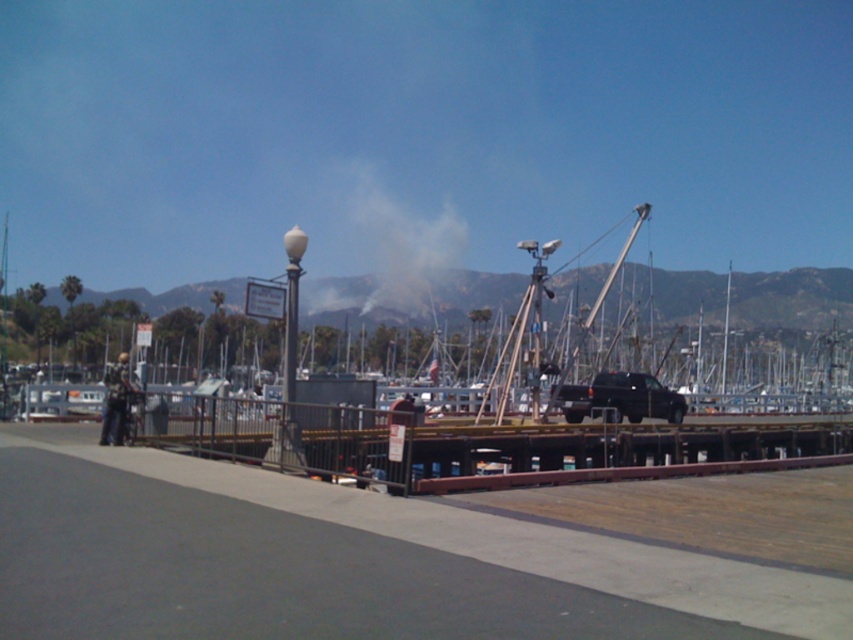
Can you confirm if wooden dock at lower center is positioned above white smoke at upper center?

No.

Who is shorter, wooden dock at lower center or white smoke at upper center?

wooden dock at lower center

At what (x,y) coordinates should I click in order to perform the action: click on wooden dock at lower center. Please return your answer as a coordinate pair (x, y). The image size is (853, 640). Looking at the image, I should click on (569, 317).

Locate an element on the screen. The width and height of the screenshot is (853, 640). wooden dock at lower center is located at coordinates (569, 317).

Is wooden dock at lower center to the right of white glossy lamp post at center from the viewer's perspective?

Yes, wooden dock at lower center is to the right of white glossy lamp post at center.

Which is more to the left, wooden dock at lower center or white glossy lamp post at center?

white glossy lamp post at center

Image resolution: width=853 pixels, height=640 pixels. What do you see at coordinates (569, 317) in the screenshot? I see `wooden dock at lower center` at bounding box center [569, 317].

The image size is (853, 640). Identify the location of wooden dock at lower center. (569, 317).

Who is taller, white smoke at upper center or white glossy lamp post at center?

white smoke at upper center

Is white smoke at upper center to the right of white glossy lamp post at center from the viewer's perspective?

Indeed, white smoke at upper center is positioned on the right side of white glossy lamp post at center.

At what (x,y) coordinates should I click in order to perform the action: click on white smoke at upper center. Please return your answer as a coordinate pair (x, y). Image resolution: width=853 pixels, height=640 pixels. Looking at the image, I should click on (381, 244).